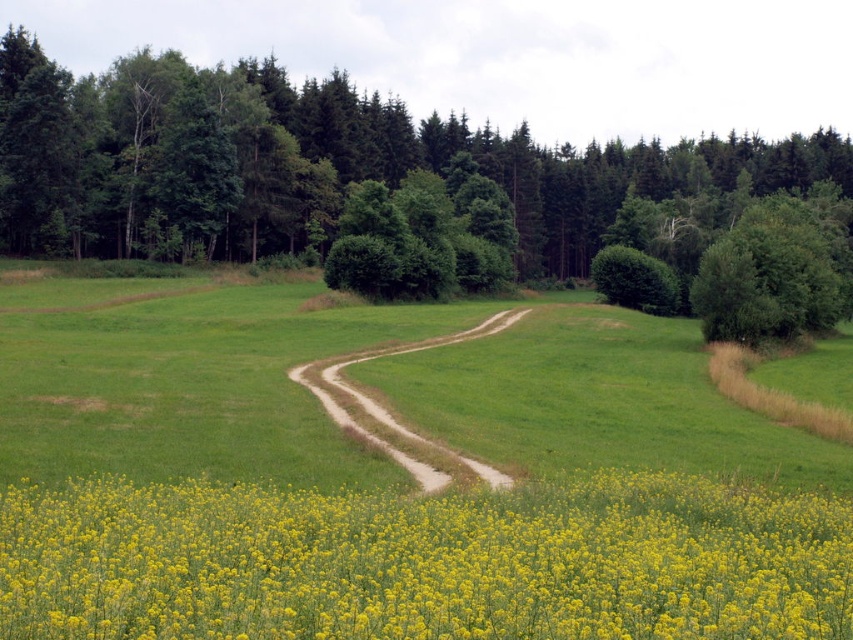
Question: In this image, where is yellow soft-textured flowers at bottom located relative to green leafy bush at upper right?

Choices:
 (A) above
 (B) below

Answer: (B)

Question: Can you confirm if green leafy tree at center is smaller than brown dirt trail at center?

Choices:
 (A) no
 (B) yes

Answer: (A)

Question: Among these objects, which one is nearest to the camera?

Choices:
 (A) yellow soft-textured flowers at bottom
 (B) green leafy bush at upper right
 (C) brown dirt trail at center
 (D) green leafy tree at center

Answer: (A)

Question: Which object appears closest to the camera in this image?

Choices:
 (A) green leafy tree at center
 (B) brown dirt trail at center
 (C) green leafy bush at upper right

Answer: (B)

Question: Can you confirm if yellow soft-textured flowers at bottom is positioned to the left of green leafy tree at center?

Choices:
 (A) yes
 (B) no

Answer: (A)

Question: Estimate the real-world distances between objects in this image. Which object is closer to the green leafy bush at upper right?

Choices:
 (A) green leafy tree at center
 (B) yellow soft-textured flowers at bottom
 (C) brown dirt trail at center

Answer: (A)